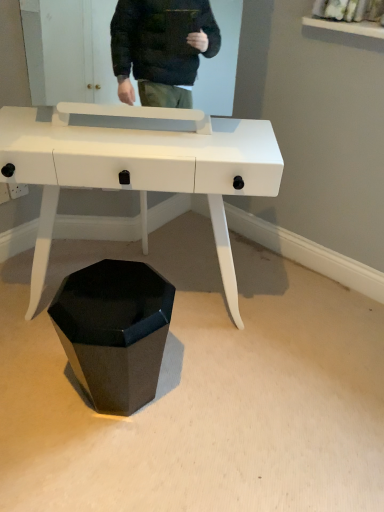
The height and width of the screenshot is (512, 384). I want to click on vacant area that is in front of glossy black hexagonal at lower center, so click(x=103, y=465).